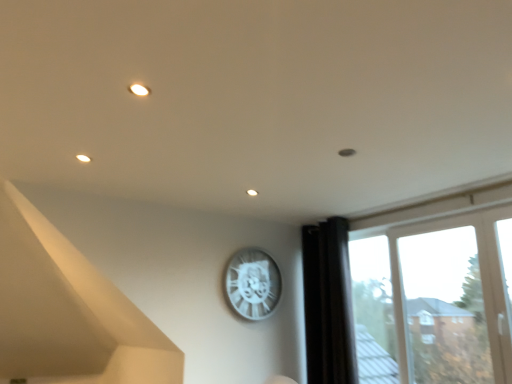
Question: Considering the positions of black fabric curtain at right and white metallic clock at upper center in the image, is black fabric curtain at right bigger or smaller than white metallic clock at upper center?

Choices:
 (A) big
 (B) small

Answer: (A)

Question: Considering the positions of black fabric curtain at right and white metallic clock at upper center in the image, is black fabric curtain at right taller or shorter than white metallic clock at upper center?

Choices:
 (A) short
 (B) tall

Answer: (B)

Question: Which is nearer to the transparent glass window at right?

Choices:
 (A) black fabric curtain at right
 (B) white metallic clock at upper center

Answer: (A)

Question: Estimate the real-world distances between objects in this image. Which object is farther from the black fabric curtain at right?

Choices:
 (A) transparent glass window at right
 (B) white metallic clock at upper center

Answer: (B)